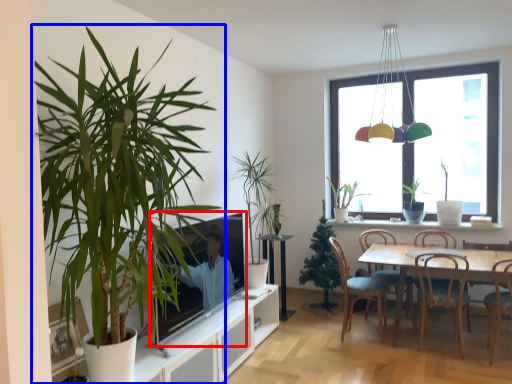
Question: Among these objects, which one is nearest to the camera, television (highlighted by a red box) or houseplant (highlighted by a blue box)?

Choices:
 (A) television
 (B) houseplant

Answer: (B)